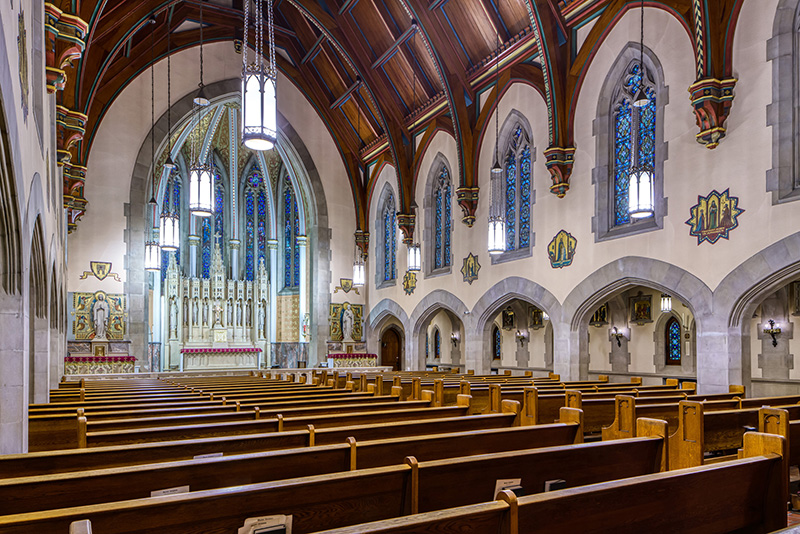
Where is `ceiling`? ceiling is located at coordinates coord(398,53), coord(116,9).